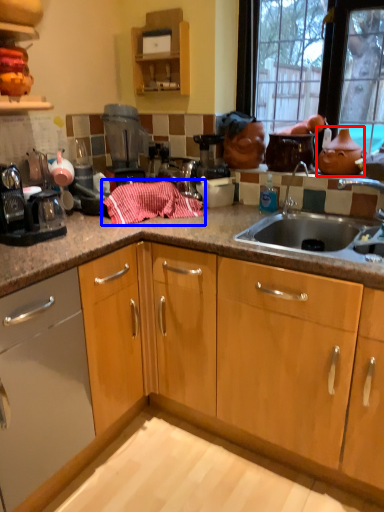
Question: Which of the following is the farthest to the observer, tea pot (highlighted by a red box) or material (highlighted by a blue box)?

Choices:
 (A) tea pot
 (B) material

Answer: (A)